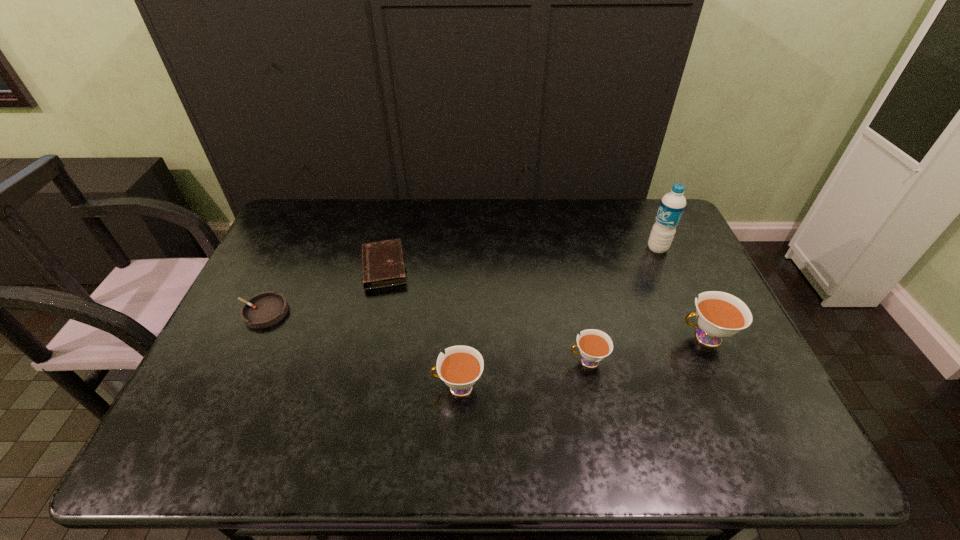
Please point a spot to add another teacup on the left. Please provide its 2D coordinates. Your answer should be formatted as a tuple, i.e. [(x, y)], where the tuple contains the x and y coordinates of a point satisfying the conditions above.

[(315, 415)]